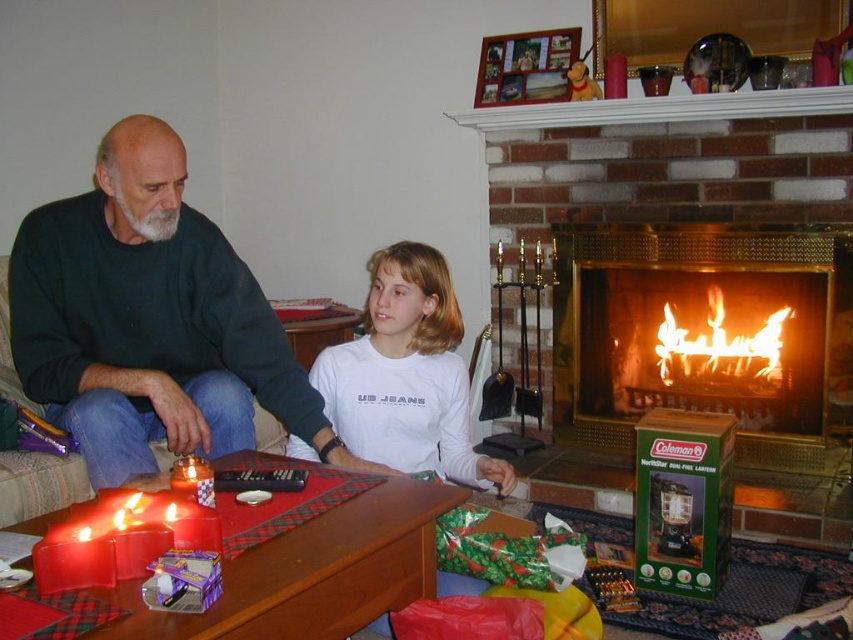
You are standing in the room and want to move from the point at coordinates point (x=699, y=381) to the point at coordinates point (x=78, y=547). Which direction should you move to get closer to your destination?

To move from point (x=699, y=381) to point (x=78, y=547), you should move downward and to the right because point (x=699, y=381) is behind point (x=78, y=547).